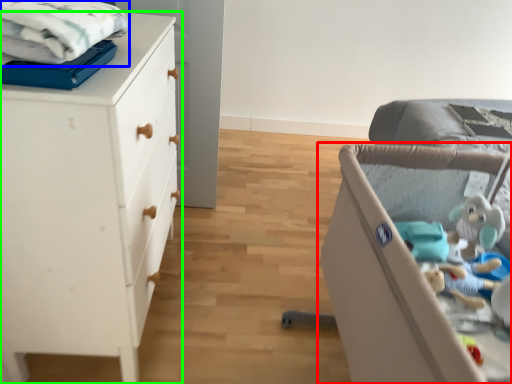
Question: Which is farther away from infant bed (highlighted by a red box)? cloth (highlighted by a blue box) or chest of drawers (highlighted by a green box)?

Choices:
 (A) cloth
 (B) chest of drawers

Answer: (A)